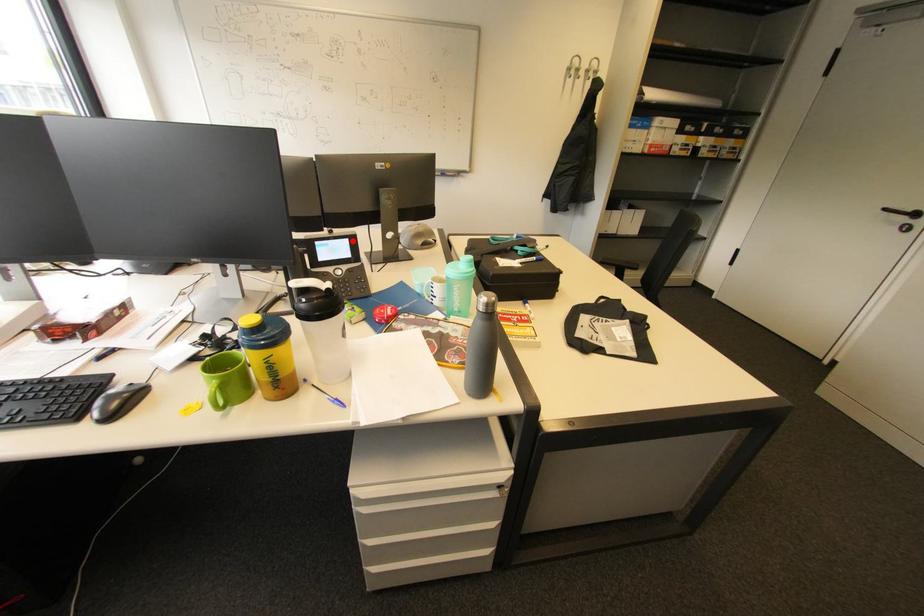
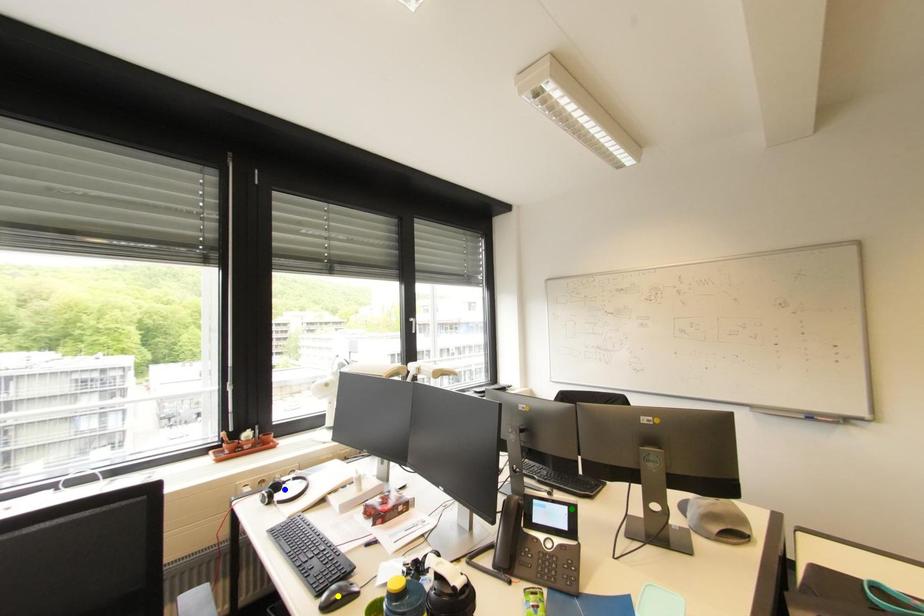
Question: I am providing you with two images of the same scene from different viewpoints. A red point is marked on the first image. You are given multiple points on the second image. Which mark in image 2 goes with the point in image 1?

Choices:
 (A) blue point
 (B) yellow point
 (C) green point

Answer: (C)